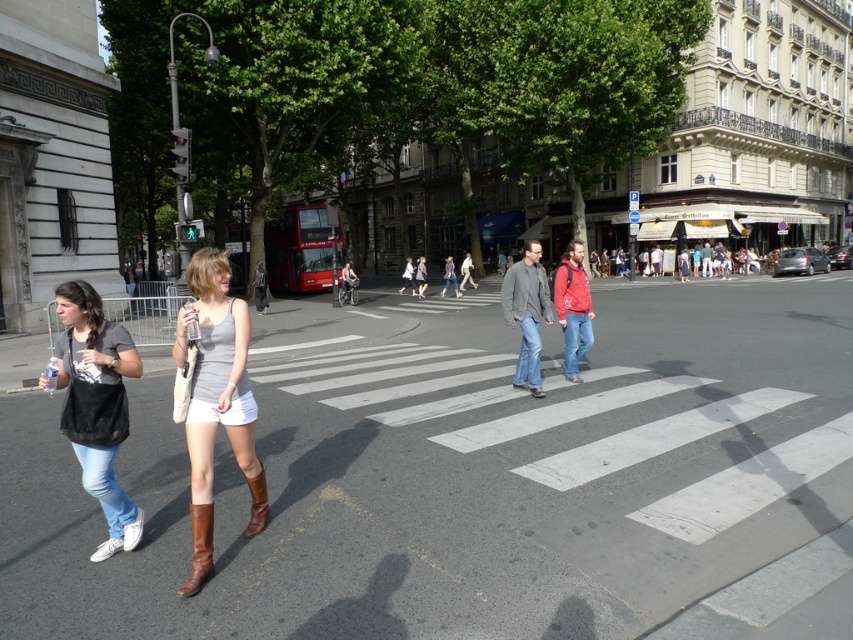
You are a delivery person who needs to place a rectangular package that is 10 inches wide between the matte black bag at left and the brown leather boot at lower center. Can you fit it horizontally between them?

The matte black bag at left is wider than the brown leather boot at lower center. Since the package is 10 inches wide, you need to check the space between them. However, the exact distance isn not provided, so it depends on the available space between the two objects.

You are a photographer trying to capture a photo of the two women walking across the pedestrian crossing. You want to ensure that both the gray matte tank top at center and the brown leather boot at lower center are clearly visible in your shot. Based on their sizes, which object should you focus on to ensure both are in frame?

The gray matte tank top at center might be wider than brown leather boot at lower center, so focusing on the gray matte tank top at center would ensure both are in frame as it is wider and central.

You are standing at point (201, 506) and want to reach the other side of the street. The road is 3.87 meters wide. If your walking speed is 1.5 meters per second, how many seconds will it take you to cross the road?

The road is 3.87 meters wide, so it will take approximately 2.58 seconds to cross at a speed of 1.5 meters per second.